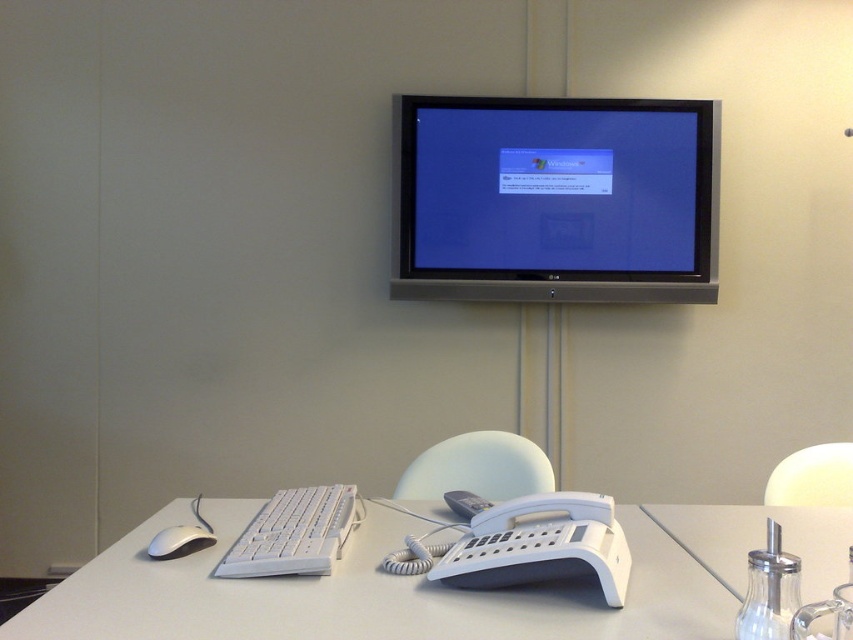
From the picture: You are setting up a new desk arrangement and want to place a plant between the black glossy monitor at upper center and the white plastic table at lower center. Is there enough space for the plant?

The black glossy monitor at upper center is positioned over the white plastic table at lower center, so there is no space between them to place a plant.

You are organizing items on the desk and need to place a new item between the clear glass bottle at lower right and the white matte mouse at lower left. Based on their positions, where should you place the new item?

The clear glass bottle at lower right is located below the white matte mouse at lower left, so you should place the new item between them in the vertical space between the two objects.